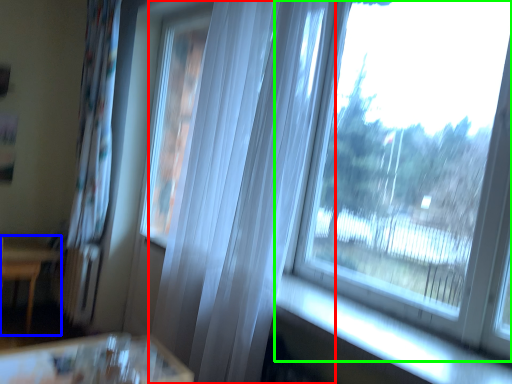
Question: Based on their relative distances, which object is nearer to curtain (highlighted by a red box)? Choose from furniture (highlighted by a blue box) and window (highlighted by a green box).

Choices:
 (A) furniture
 (B) window

Answer: (B)